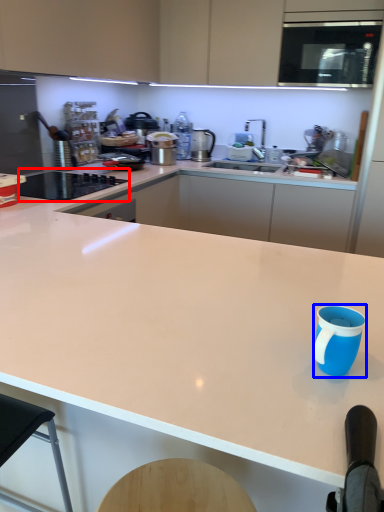
Question: Which point is further to the camera, home appliance (highlighted by a red box) or mug (highlighted by a blue box)?

Choices:
 (A) home appliance
 (B) mug

Answer: (A)